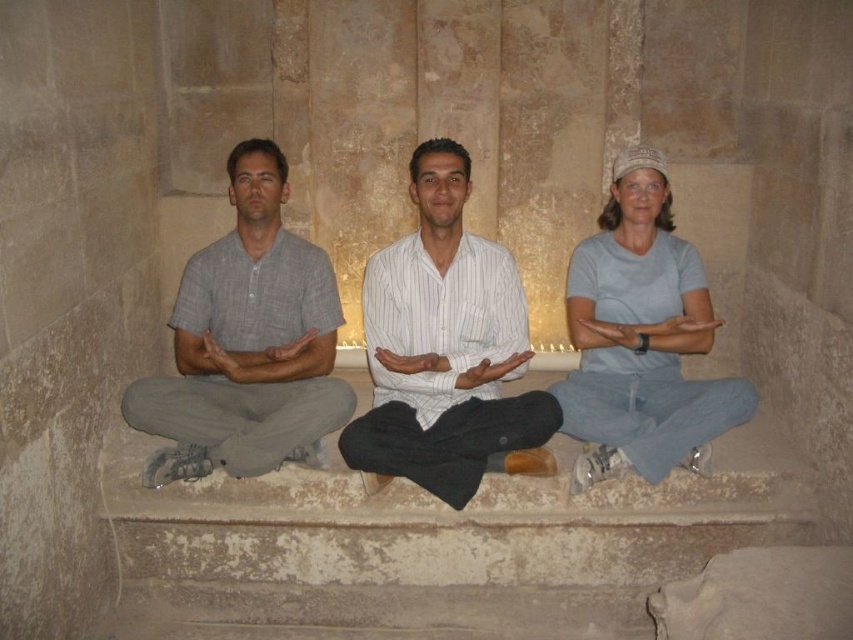
Between gray cotton shirt at left and light blue cotton shirt at center, which one is positioned lower?

light blue cotton shirt at center is lower down.

Is gray cotton shirt at left positioned at the back of light blue cotton shirt at center?

That is True.

I want to click on gray cotton shirt at left, so click(247, 340).

Is white striped shirt at center shorter than gray cotton shirt at left?

No.

Who is higher up, white striped shirt at center or gray cotton shirt at left?

gray cotton shirt at left

Between point (410, 404) and point (228, 451), which one is positioned behind?

The point (410, 404) is behind.

This screenshot has height=640, width=853. I want to click on white striped shirt at center, so click(x=445, y=348).

Can you confirm if white striped shirt at center is positioned to the right of light blue cotton shirt at center?

No, white striped shirt at center is not to the right of light blue cotton shirt at center.

Who is more distant from viewer, (427, 339) or (670, 214)?

The point (670, 214) is more distant.

You are a GUI agent. You are given a task and a screenshot of the screen. Output one action in this format:
    pyautogui.click(x=<x>, y=<y>)
    Task: Click on the white striped shirt at center
    The image size is (853, 640).
    Given the screenshot: What is the action you would take?
    pyautogui.click(x=445, y=348)